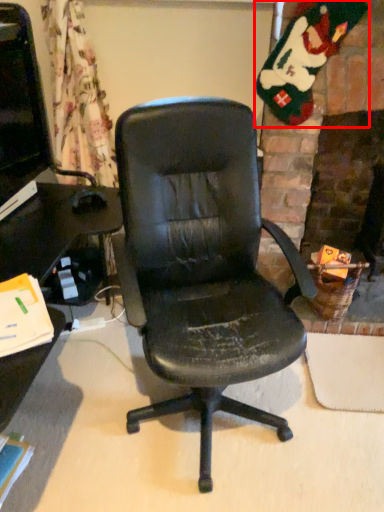
Question: From the image's perspective, where is santa claus (annotated by the red box) located in relation to computer monitor in the image?

Choices:
 (A) below
 (B) above

Answer: (B)